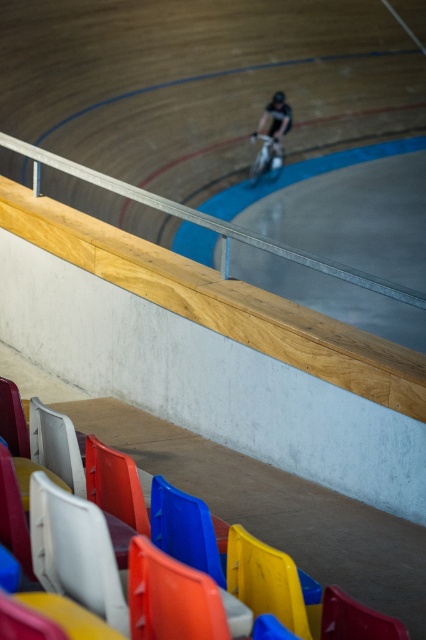
Question: Which of these objects is positioned farthest from the blue plastic chair at lower center?

Choices:
 (A) black matte bicycle at center
 (B) white plastic chair at lower left

Answer: (A)

Question: Does white plastic chair at lower left appear on the left side of black matte bicycle at center?

Choices:
 (A) yes
 (B) no

Answer: (A)

Question: Does white plastic chair at lower left appear on the left side of black matte bicycle at center?

Choices:
 (A) no
 (B) yes

Answer: (B)

Question: Does white plastic chair at lower left have a larger size compared to black matte bicycle at center?

Choices:
 (A) no
 (B) yes

Answer: (A)

Question: Among these points, which one is nearest to the camera?

Choices:
 (A) (69, 596)
 (B) (275, 96)
 (C) (339, 604)

Answer: (C)

Question: Among these objects, which one is farthest from the camera?

Choices:
 (A) blue plastic chair at lower center
 (B) white plastic chair at lower left

Answer: (B)